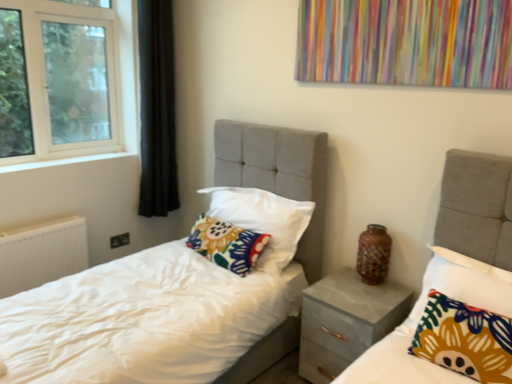
Question: Could you tell me if floral fabric pillow at center, which appears as the 3th pillow when viewed from the back, is turned towards floral fabric pillow at center, which appears as the first pillow when viewed from the back?

Choices:
 (A) yes
 (B) no

Answer: (B)

Question: From the image's perspective, is floral fabric pillow at center, arranged as the 1th pillow when viewed from the front, under floral fabric pillow at center, which appears as the first pillow when viewed from the back?

Choices:
 (A) no
 (B) yes

Answer: (B)

Question: Is floral fabric pillow at center, arranged as the 1th pillow when viewed from the front, smaller than floral fabric pillow at center, which appears as the first pillow when viewed from the back?

Choices:
 (A) no
 (B) yes

Answer: (B)

Question: Does floral fabric pillow at center, which appears as the 3th pillow when viewed from the back, have a greater height compared to floral fabric pillow at center, which is the 3th pillow from front to back?

Choices:
 (A) no
 (B) yes

Answer: (B)

Question: From a real-world perspective, is floral fabric pillow at center, arranged as the 1th pillow when viewed from the front, beneath floral fabric pillow at center, which appears as the first pillow when viewed from the back?

Choices:
 (A) no
 (B) yes

Answer: (A)

Question: Is floral fabric pillow at center, arranged as the 1th pillow when viewed from the front, located outside floral fabric pillow at center, which appears as the first pillow when viewed from the back?

Choices:
 (A) no
 (B) yes

Answer: (B)

Question: Is floral fabric pillow at center, which appears as the 3th pillow when viewed from the back, oriented away from white textured radiator at lower left?

Choices:
 (A) no
 (B) yes

Answer: (A)

Question: Can you confirm if floral fabric pillow at center, arranged as the 1th pillow when viewed from the front, is thinner than white textured radiator at lower left?

Choices:
 (A) no
 (B) yes

Answer: (A)

Question: Is floral fabric pillow at center, arranged as the 1th pillow when viewed from the front, oriented towards white textured radiator at lower left?

Choices:
 (A) no
 (B) yes

Answer: (A)

Question: Is the position of floral fabric pillow at center, arranged as the 1th pillow when viewed from the front, less distant than that of white textured radiator at lower left?

Choices:
 (A) yes
 (B) no

Answer: (A)

Question: Would you say white textured radiator at lower left is part of floral fabric pillow at center, arranged as the 1th pillow when viewed from the front,'s contents?

Choices:
 (A) no
 (B) yes

Answer: (A)

Question: Is floral fabric pillow at center, arranged as the 1th pillow when viewed from the front, to the right of white textured radiator at lower left from the viewer's perspective?

Choices:
 (A) yes
 (B) no

Answer: (A)

Question: From the image's perspective, would you say floral fabric pillow at center, which appears as the first pillow when viewed from the back, is shown under floral fabric pillow at center, the 2th pillow from the back?

Choices:
 (A) yes
 (B) no

Answer: (A)